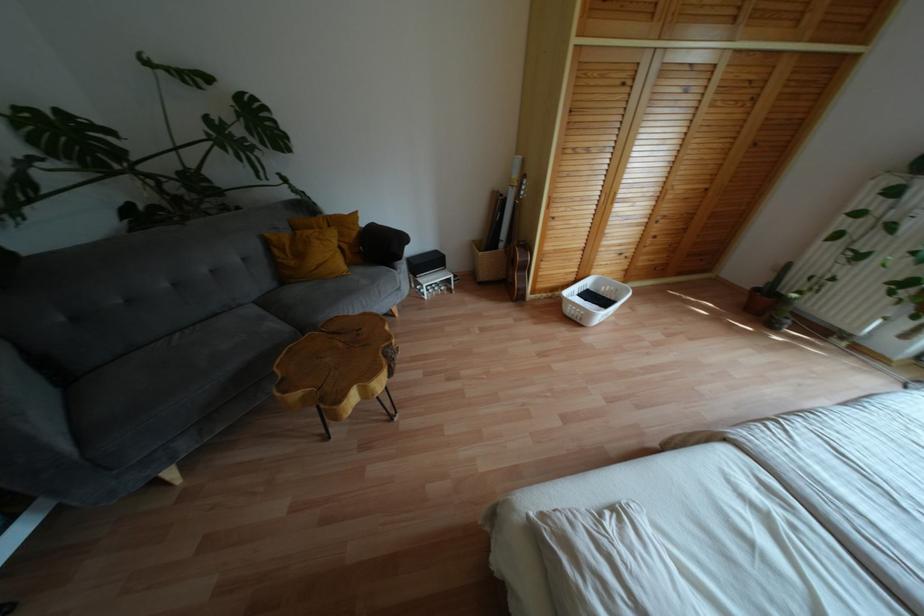
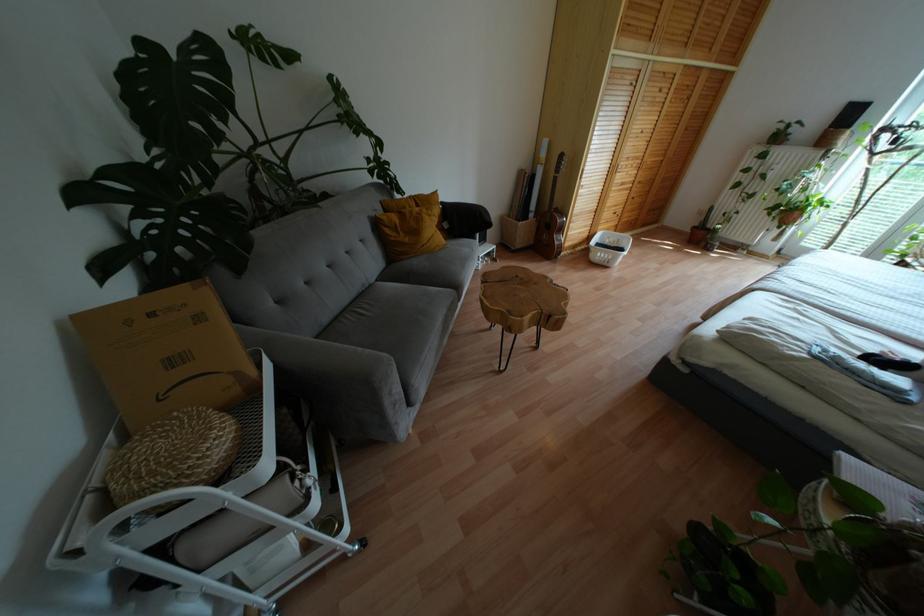
Find the pixel in the second image that matches point (354, 214) in the first image.

(434, 193)